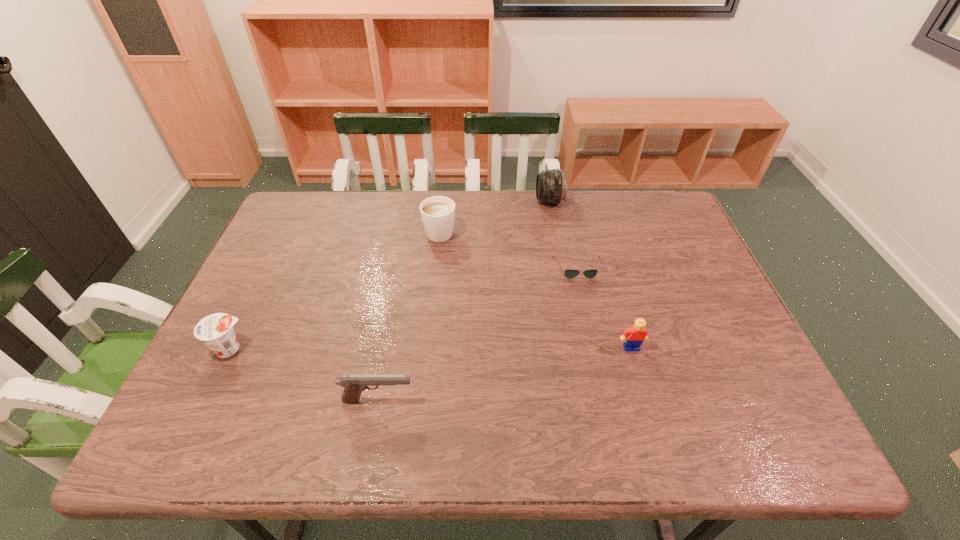
Where is `the farthest object`? This screenshot has width=960, height=540. the farthest object is located at coordinates (551, 186).

Find the location of `the second farthest object`. the second farthest object is located at coordinates (437, 213).

This screenshot has width=960, height=540. Find the location of `Lego`. Lego is located at coordinates (636, 334).

Where is `pistol`? pistol is located at coordinates (354, 384).

Find the location of a particular element. the second shortest object is located at coordinates (216, 330).

Find the location of a particular element. This screenshot has height=540, width=960. yogurt is located at coordinates (216, 330).

At what (x,y) coordinates should I click in order to perform the action: click on the third farthest object. Please return your answer as a coordinate pair (x, y). This screenshot has width=960, height=540. Looking at the image, I should click on (569, 273).

Identify the location of the shortest object. The image size is (960, 540). (569, 273).

Identify the location of free point located at the front element of the telephoto lens. coord(470,201).

You are a GUI agent. You are given a task and a screenshot of the screen. Output one action in this format:
    pyautogui.click(x=<x>, y=<y>)
    Task: Click on the vacant space located at the front element of the telephoto lens
    The width and height of the screenshot is (960, 540).
    Given the screenshot: What is the action you would take?
    pyautogui.click(x=422, y=201)